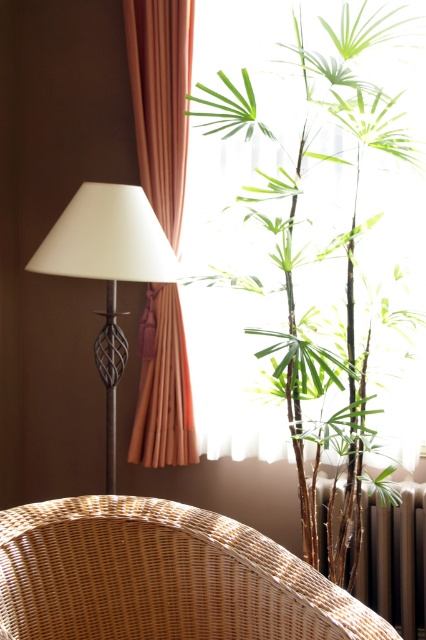
Is woven wicker armchair at lower left wider than matte white lamp at left?

Yes.

Is woven wicker armchair at lower left smaller than matte white lamp at left?

Yes.

Is point (111, 616) closer to camera compared to point (83, 195)?

That is True.

Find the location of `woven wicker armchair at lower left`. woven wicker armchair at lower left is located at coordinates (161, 577).

Is point (80, 577) closer to camera compared to point (134, 90)?

That is True.

Is woven wicker armchair at lower left positioned at the back of orange fabric curtain at left?

No, woven wicker armchair at lower left is closer to the viewer.

At what (x,y) coordinates should I click in order to perform the action: click on woven wicker armchair at lower left. Please return your answer as a coordinate pair (x, y). The image size is (426, 640). Looking at the image, I should click on (161, 577).

Which is in front, point (141, 68) or point (118, 220)?

Positioned in front is point (118, 220).

Between orange fabric curtain at left and matte white lamp at left, which one appears on the right side from the viewer's perspective?

From the viewer's perspective, orange fabric curtain at left appears more on the right side.

Between point (141, 125) and point (62, 216), which one is positioned in front?

Point (62, 216) is in front.

Image resolution: width=426 pixels, height=640 pixels. Identify the location of orange fabric curtain at left. (161, 100).